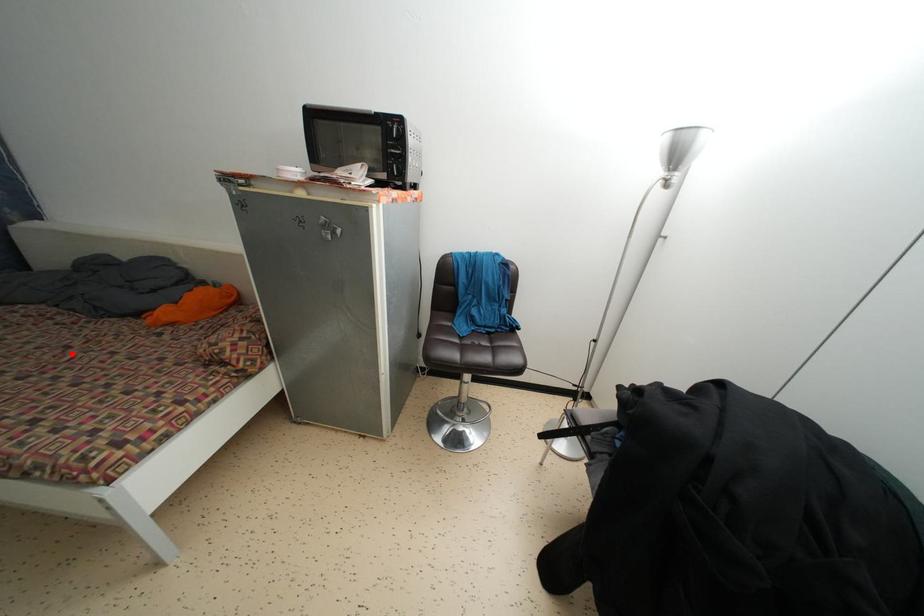
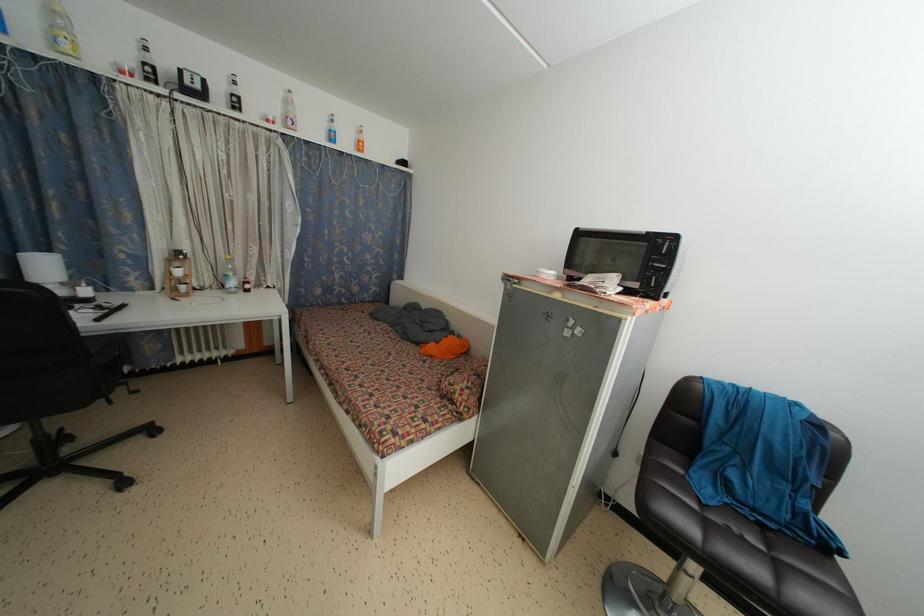
In the second image, find the point that corresponds to the highlighted location in the first image.

(394, 360)